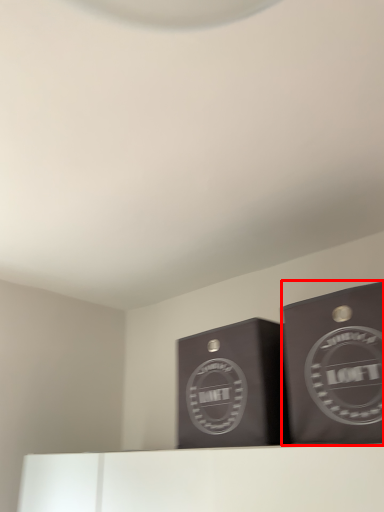
Question: From the image's perspective, where is cardboard box (annotated by the red box) located in relation to cardboard box in the image?

Choices:
 (A) above
 (B) below

Answer: (A)